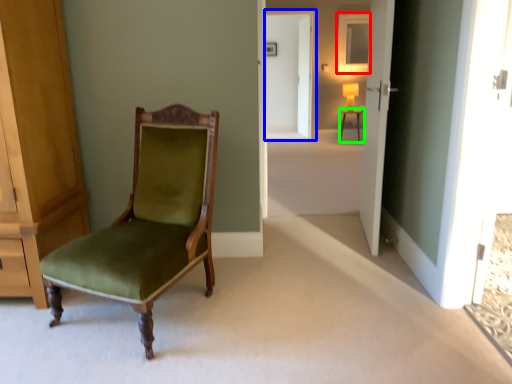
Question: Which is farther away from mirror (highlighted by a red box)? screen door (highlighted by a blue box) or desk (highlighted by a green box)?

Choices:
 (A) screen door
 (B) desk

Answer: (B)